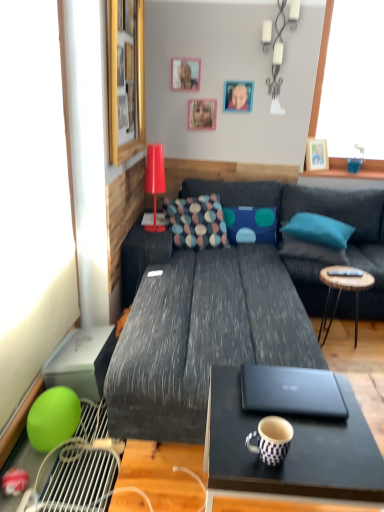
Find the location of a particular element. The image size is (384, 512). free spot to the right of blue and white checkered coffee cup at lower center is located at coordinates (324, 454).